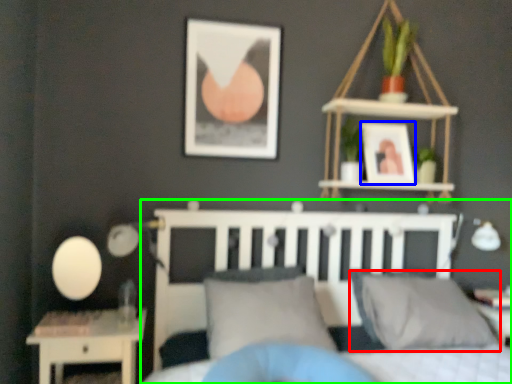
Question: Which is farther away from pillow (highlighted by a red box)? picture frame (highlighted by a blue box) or bed (highlighted by a green box)?

Choices:
 (A) picture frame
 (B) bed

Answer: (A)